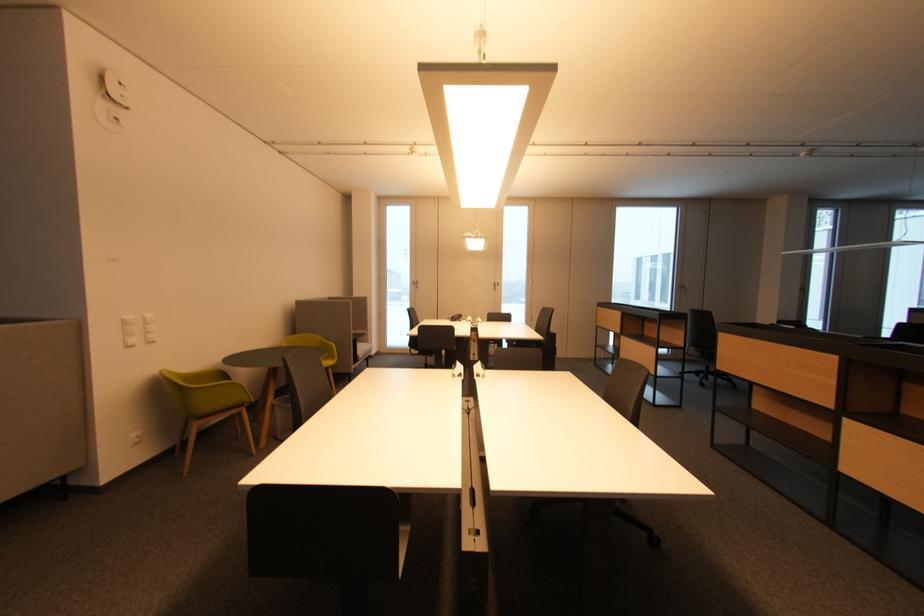
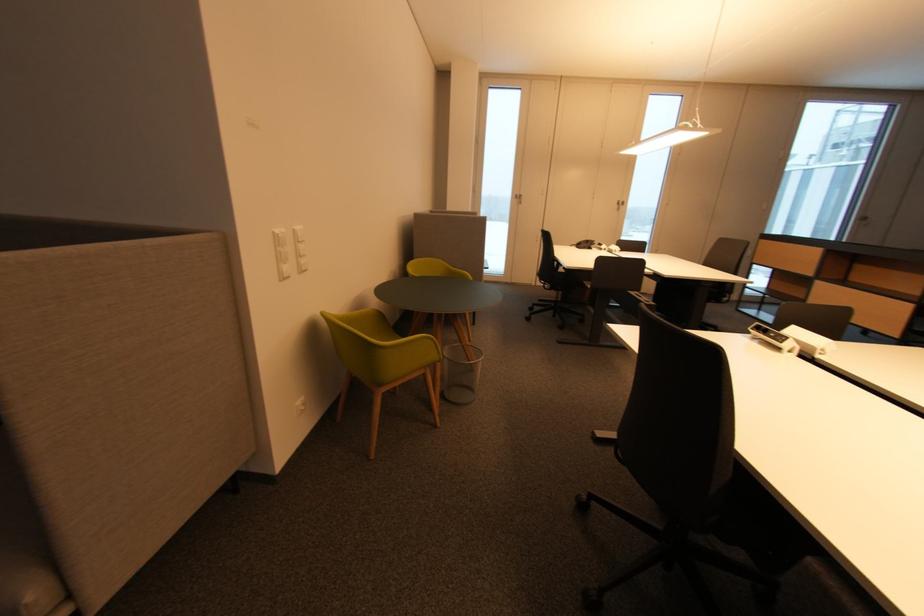
The images are taken continuously from a first-person perspective. In which direction are you moving?

The cameraman moved toward left, forward.